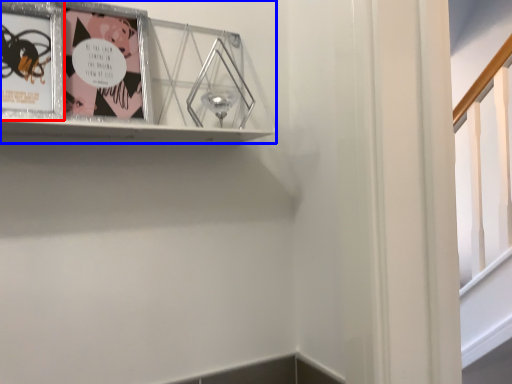
Question: Which of the following is the closest to the observer, picture frame (highlighted by a red box) or picture frame (highlighted by a blue box)?

Choices:
 (A) picture frame
 (B) picture frame

Answer: (B)